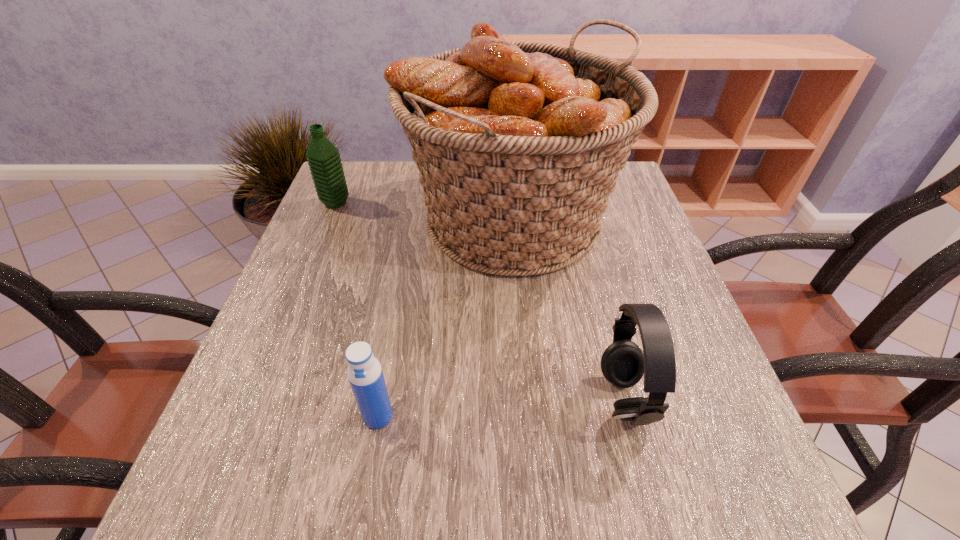
This screenshot has height=540, width=960. Identify the location of the tallest object. (518, 144).

This screenshot has width=960, height=540. Find the location of `the taller water bottle`. the taller water bottle is located at coordinates (323, 158).

At what (x,y) coordinates should I click in order to perform the action: click on the farther water bottle. Please return your answer as a coordinate pair (x, y). The width and height of the screenshot is (960, 540). Looking at the image, I should click on (323, 158).

At what (x,y) coordinates should I click in order to perform the action: click on earphone. Please return your answer as a coordinate pair (x, y). The height and width of the screenshot is (540, 960). Looking at the image, I should click on (623, 363).

This screenshot has width=960, height=540. In order to click on the shorter water bottle in this screenshot , I will do (x=364, y=372).

Where is `the nearer water bottle`? Image resolution: width=960 pixels, height=540 pixels. the nearer water bottle is located at coordinates (364, 372).

At what (x,y) coordinates should I click in order to perform the action: click on vacant space located 0.250m on the front of the tallest object. Please return your answer as a coordinate pair (x, y). This screenshot has width=960, height=540. Looking at the image, I should click on (529, 408).

At what (x,y) coordinates should I click in order to perform the action: click on vacant space located on the front of the taller water bottle. Please return your answer as a coordinate pair (x, y). The width and height of the screenshot is (960, 540). Looking at the image, I should click on (320, 242).

This screenshot has width=960, height=540. I want to click on vacant space located on the ear cups of the earphone, so click(382, 399).

Image resolution: width=960 pixels, height=540 pixels. I want to click on vacant area situated on the ear cups of the earphone, so click(x=553, y=399).